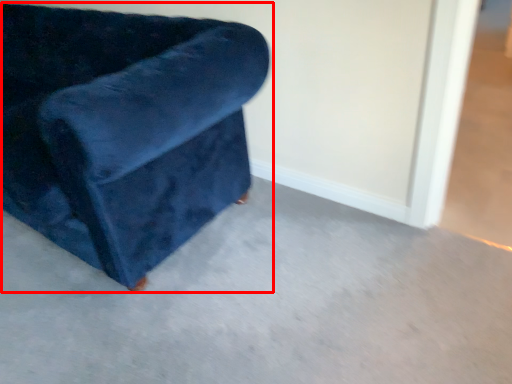
Question: From the image's perspective, considering the relative positions of chair (annotated by the red box) and concrete in the image provided, where is chair (annotated by the red box) located with respect to the staircase?

Choices:
 (A) below
 (B) above

Answer: (B)